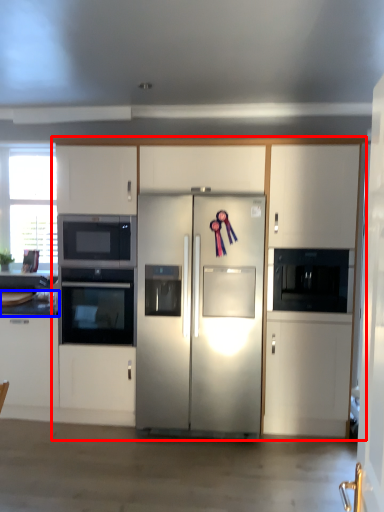
Question: Which object appears closest to the camera in this image, cabinetry (highlighted by a red box) or countertop (highlighted by a blue box)?

Choices:
 (A) cabinetry
 (B) countertop

Answer: (A)